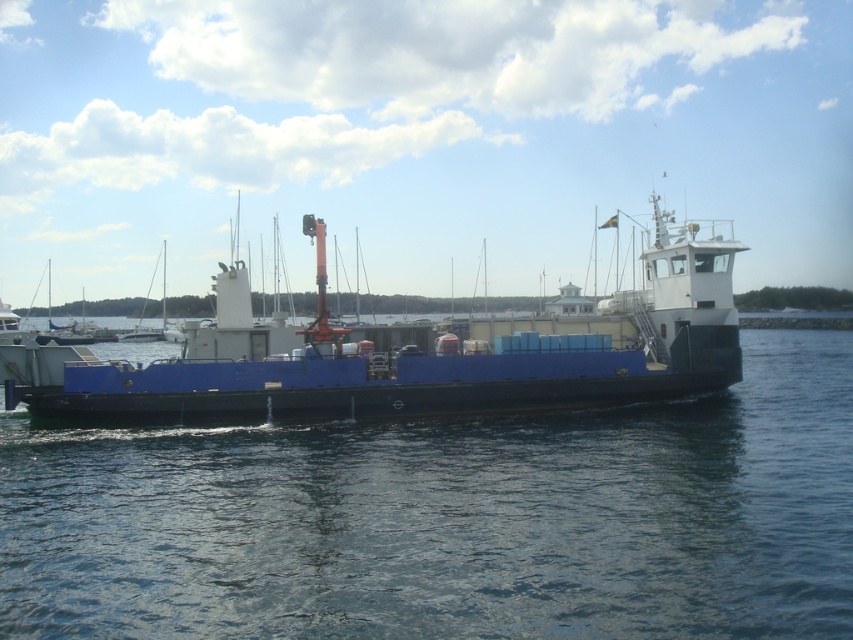
You are standing on the deck of the large blue and white cargo ship and want to look out towards the blue water at center. Which direction should you face if you are at point (450, 518)?

You are already at the blue water at center, so you can look in any direction from there.

Based on the photo, you are standing on the deck of the blue matte boat at center and looking towards the blue water at center. Which object is closer to your eyes?

The blue matte boat at center is closer to your eyes because it is the surface you are standing on, while the blue water at center is below and farther away.

You are standing on the dock and looking at the blue water at center and the blue matte boat at center. Which object is nearer to you?

The blue water at center is closer to the viewer than the blue matte boat at center.